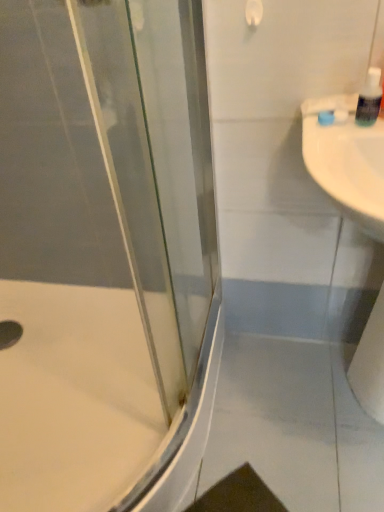
Identify the location of white glossy sink at right. coord(346,160).

What do you see at coordinates (346, 160) in the screenshot? Image resolution: width=384 pixels, height=512 pixels. I see `white glossy sink at right` at bounding box center [346, 160].

At what (x,y) coordinates should I click in order to perform the action: click on white glossy sink at right. Please return your answer as a coordinate pair (x, y). The width and height of the screenshot is (384, 512). Looking at the image, I should click on click(346, 160).

Considering the sizes of objects clear plastic soap dispenser at upper right and transparent glass shower door at left in the image provided, who is taller, clear plastic soap dispenser at upper right or transparent glass shower door at left?

With more height is transparent glass shower door at left.

Is clear plastic soap dispenser at upper right not within transparent glass shower door at left?

clear plastic soap dispenser at upper right lies outside transparent glass shower door at left's area.

The width and height of the screenshot is (384, 512). I want to click on shower door below the clear plastic soap dispenser at upper right (from a real-world perspective), so click(x=105, y=254).

Is clear plastic soap dispenser at upper right to the left or to the right of transparent glass shower door at left in the image?

In the image, clear plastic soap dispenser at upper right appears on the right side of transparent glass shower door at left.

Is clear plastic soap dispenser at upper right looking in the opposite direction of white matte toilet paper at right?

clear plastic soap dispenser at upper right is not turned away from white matte toilet paper at right.

What's the angular difference between clear plastic soap dispenser at upper right and white matte toilet paper at right's facing directions?

They differ by 7.6 degrees in their facing directions.

Can white matte toilet paper at right be found inside clear plastic soap dispenser at upper right?

That's incorrect, white matte toilet paper at right is not inside clear plastic soap dispenser at upper right.

From the picture: Which of these two, clear plastic soap dispenser at upper right or white matte toilet paper at right, stands shorter?

With less height is clear plastic soap dispenser at upper right.

How different are the orientations of clear plastic soap dispenser at upper right and white glossy sink at right in degrees?

There is a 7.24-degree angle between the facing directions of clear plastic soap dispenser at upper right and white glossy sink at right.

From the picture: Can you confirm if clear plastic soap dispenser at upper right is taller than white glossy sink at right?

In fact, clear plastic soap dispenser at upper right may be shorter than white glossy sink at right.

Is clear plastic soap dispenser at upper right facing towards white glossy sink at right?

No, clear plastic soap dispenser at upper right is not facing towards white glossy sink at right.

Considering the positions of objects clear plastic soap dispenser at upper right and white glossy sink at right in the image provided, who is more to the right, clear plastic soap dispenser at upper right or white glossy sink at right?

From the viewer's perspective, clear plastic soap dispenser at upper right appears more on the right side.

Can we say white glossy bath at lower left lies outside white glossy sink at right?

Absolutely, white glossy bath at lower left is external to white glossy sink at right.

Considering the relative positions of white glossy bath at lower left and white glossy sink at right in the image provided, is white glossy bath at lower left behind white glossy sink at right?

That is True.

Which object is thinner, white glossy bath at lower left or white glossy sink at right?

white glossy sink at right.

From a real-world perspective, is white glossy bath at lower left above or below clear plastic soap dispenser at upper right?

In terms of real-world spatial position, white glossy bath at lower left is below clear plastic soap dispenser at upper right.

At what (x,y) coordinates should I click in order to perform the action: click on bath beneath the clear plastic soap dispenser at upper right (from a real-world perspective). Please return your answer as a coordinate pair (x, y). Looking at the image, I should click on (75, 399).

Is white glossy bath at lower left oriented towards clear plastic soap dispenser at upper right?

No, white glossy bath at lower left is not turned towards clear plastic soap dispenser at upper right.

Consider the image. Is white glossy bath at lower left far from clear plastic soap dispenser at upper right?

Actually, white glossy bath at lower left and clear plastic soap dispenser at upper right are a little close together.

Are white glossy bath at lower left and white matte toilet paper at right located far from each other?

That's not correct — white glossy bath at lower left is a little close to white matte toilet paper at right.

Between white glossy bath at lower left and white matte toilet paper at right, which one appears on the left side from the viewer's perspective?

Positioned to the left is white glossy bath at lower left.

Measure the distance between white glossy bath at lower left and white matte toilet paper at right.

The distance of white glossy bath at lower left from white matte toilet paper at right is 28.29 inches.

Who is shorter, white glossy bath at lower left or white matte toilet paper at right?

white glossy bath at lower left is shorter.

Where is `toilet paper that is below the clear plastic soap dispenser at upper right (from the image's perspective)`? Image resolution: width=384 pixels, height=512 pixels. toilet paper that is below the clear plastic soap dispenser at upper right (from the image's perspective) is located at coordinates (370, 362).

Is white matte toilet paper at right smaller than clear plastic soap dispenser at upper right?

Actually, white matte toilet paper at right might be larger than clear plastic soap dispenser at upper right.

Are white matte toilet paper at right and clear plastic soap dispenser at upper right making contact?

white matte toilet paper at right and clear plastic soap dispenser at upper right are clearly separated.

Looking at this image, what's the angular difference between white matte toilet paper at right and clear plastic soap dispenser at upper right's facing directions?

7.6 degrees separate the facing orientations of white matte toilet paper at right and clear plastic soap dispenser at upper right.

I want to click on soap dispenser above the transparent glass shower door at left (from the image's perspective), so click(369, 99).

I want to click on soap dispenser to the left of white matte toilet paper at right, so click(x=369, y=99).

Which object lies nearer to the anchor point transparent glass shower door at left, white matte toilet paper at right or white glossy sink at right?

Based on the image, white glossy sink at right appears to be nearer to transparent glass shower door at left.

Consider the image. Based on their spatial positions, is transparent glass shower door at left or white glossy bath at lower left closer to white matte toilet paper at right?

The object closer to white matte toilet paper at right is white glossy bath at lower left.

When comparing their distances from white glossy bath at lower left, does transparent glass shower door at left or clear plastic soap dispenser at upper right seem closer?

Based on the image, transparent glass shower door at left appears to be nearer to white glossy bath at lower left.

When comparing their distances from white glossy bath at lower left, does transparent glass shower door at left or white matte toilet paper at right seem closer?

The object closer to white glossy bath at lower left is transparent glass shower door at left.

Looking at this image, considering their positions, is transparent glass shower door at left positioned further to clear plastic soap dispenser at upper right than white matte toilet paper at right?

Among the two, transparent glass shower door at left is located further to clear plastic soap dispenser at upper right.

Considering their positions, is white matte toilet paper at right positioned further to white glossy sink at right than clear plastic soap dispenser at upper right?

white matte toilet paper at right.

Considering their positions, is white glossy sink at right positioned closer to white glossy bath at lower left than white matte toilet paper at right?

white matte toilet paper at right.

From the image, which object appears to be farther from white matte toilet paper at right, clear plastic soap dispenser at upper right or transparent glass shower door at left?

transparent glass shower door at left is further to white matte toilet paper at right.

Where is `sink between clear plastic soap dispenser at upper right and white matte toilet paper at right vertically`? sink between clear plastic soap dispenser at upper right and white matte toilet paper at right vertically is located at coordinates [346, 160].

The width and height of the screenshot is (384, 512). I want to click on sink located between white glossy bath at lower left and clear plastic soap dispenser at upper right in the left-right direction, so click(x=346, y=160).

Locate an element on the screen. shower door located between white glossy bath at lower left and white matte toilet paper at right in the left-right direction is located at coordinates [105, 254].

Locate an element on the screen. The height and width of the screenshot is (512, 384). sink situated between transparent glass shower door at left and clear plastic soap dispenser at upper right from left to right is located at coordinates (346, 160).